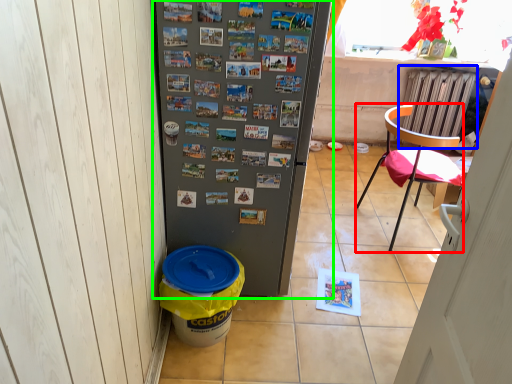
Question: Which object is positioned closest to chair (highlighted by a red box)? Select from radiator (highlighted by a blue box) and refrigerator (highlighted by a green box).

Choices:
 (A) radiator
 (B) refrigerator

Answer: (A)